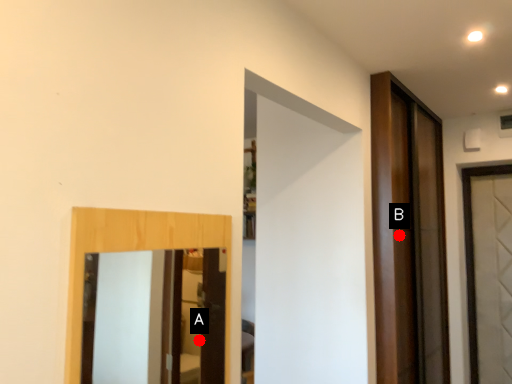
Question: Two points are circled on the image, labeled by A and B beside each circle. Which point appears closest to the camera in this image?

Choices:
 (A) A is closer
 (B) B is closer

Answer: (B)